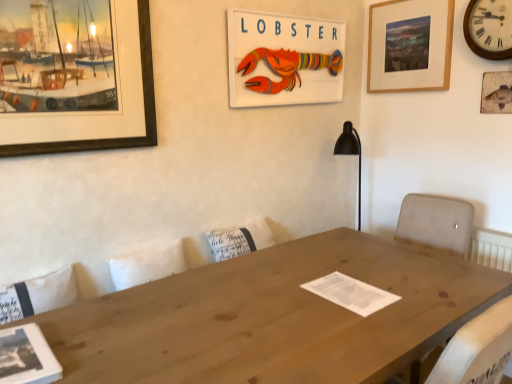
Question: Is the surface of wooden lobster sign at upper center, acting as the 3th picture frame starting from the right, in direct contact with natural wood table at center?

Choices:
 (A) yes
 (B) no

Answer: (B)

Question: Can you confirm if wooden lobster sign at upper center, acting as the 3th picture frame starting from the right, is thinner than natural wood table at center?

Choices:
 (A) yes
 (B) no

Answer: (A)

Question: Considering the relative positions of wooden lobster sign at upper center, acting as the 2th picture frame starting from the left, and natural wood table at center in the image provided, is wooden lobster sign at upper center, acting as the 2th picture frame starting from the left, to the right of natural wood table at center from the viewer's perspective?

Choices:
 (A) no
 (B) yes

Answer: (B)

Question: Does wooden lobster sign at upper center, acting as the 3th picture frame starting from the right, appear on the left side of natural wood table at center?

Choices:
 (A) no
 (B) yes

Answer: (A)

Question: Is wooden lobster sign at upper center, acting as the 3th picture frame starting from the right, smaller than natural wood table at center?

Choices:
 (A) no
 (B) yes

Answer: (B)

Question: Would you say natural wood table at center is part of wooden lobster sign at upper center, acting as the 2th picture frame starting from the left,'s contents?

Choices:
 (A) no
 (B) yes

Answer: (A)

Question: Can you confirm if natural wood table at center is positioned to the right of wooden picture frame at upper right, which is counted as the first picture frame, starting from the right?

Choices:
 (A) no
 (B) yes

Answer: (A)

Question: Considering the relative positions of natural wood table at center and wooden picture frame at upper right, which is counted as the first picture frame, starting from the right, in the image provided, is natural wood table at center in front of wooden picture frame at upper right, which is counted as the first picture frame, starting from the right,?

Choices:
 (A) yes
 (B) no

Answer: (A)

Question: Does natural wood table at center have a greater width compared to wooden picture frame at upper right, which is counted as the first picture frame, starting from the right?

Choices:
 (A) no
 (B) yes

Answer: (B)

Question: Considering the relative positions of natural wood table at center and wooden picture frame at upper right, which is counted as the first picture frame, starting from the right, in the image provided, is natural wood table at center to the left of wooden picture frame at upper right, which is counted as the first picture frame, starting from the right, from the viewer's perspective?

Choices:
 (A) yes
 (B) no

Answer: (A)

Question: Is natural wood table at center looking in the opposite direction of wooden picture frame at upper right, which is counted as the first picture frame, starting from the right?

Choices:
 (A) yes
 (B) no

Answer: (B)

Question: Is natural wood table at center thinner than wooden picture frame at upper right, the fourth picture frame in the left-to-right sequence?

Choices:
 (A) no
 (B) yes

Answer: (A)

Question: Is wooden picture frame at upper right, marked as the third picture frame in a left-to-right arrangement, at the left side of wooden clock at upper right?

Choices:
 (A) no
 (B) yes

Answer: (B)